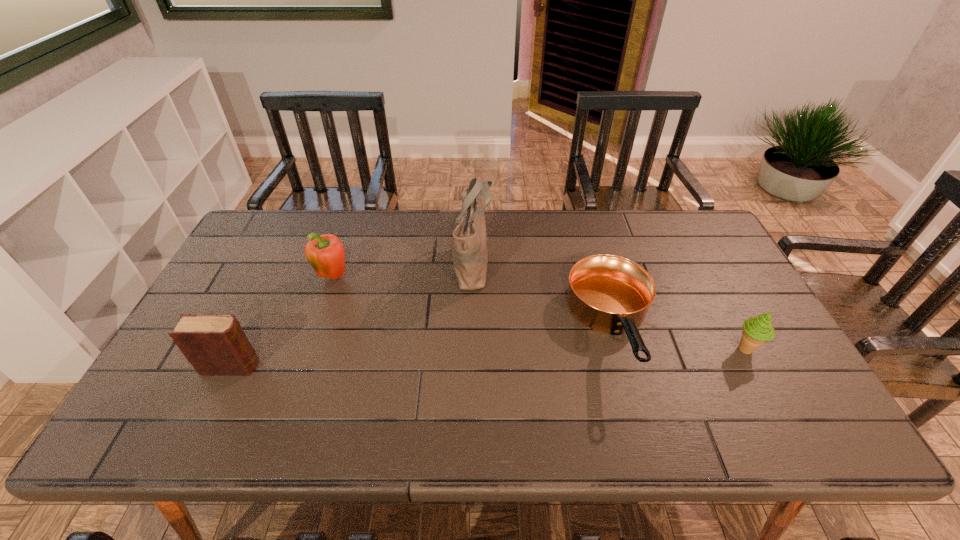
Find the location of `the tallest object`. the tallest object is located at coordinates click(470, 254).

Where is `shoulder bag`? The width and height of the screenshot is (960, 540). shoulder bag is located at coordinates pos(470,254).

Find the location of a particular element. This screenshot has width=960, height=540. pepper is located at coordinates (326, 255).

Find the location of a particular element. The width and height of the screenshot is (960, 540). the leftmost object is located at coordinates (214, 344).

At what (x,y) coordinates should I click in order to perform the action: click on the rightmost object. Please return your answer as a coordinate pair (x, y). Looking at the image, I should click on pos(757,330).

Identify the location of frying pan. This screenshot has height=540, width=960. (607, 293).

Where is `vacant space located on the front-facing side of the shoulder bag`? Image resolution: width=960 pixels, height=540 pixels. vacant space located on the front-facing side of the shoulder bag is located at coordinates (555, 262).

The image size is (960, 540). I want to click on vacant region located on the left of the pepper, so [239, 278].

At what (x,y) coordinates should I click in order to perform the action: click on vacant space situated on the spine side of the diary. Please return your answer as a coordinate pair (x, y). This screenshot has width=960, height=540. Looking at the image, I should click on (316, 366).

This screenshot has height=540, width=960. I want to click on free spot located on the back of the rightmost object, so click(x=691, y=247).